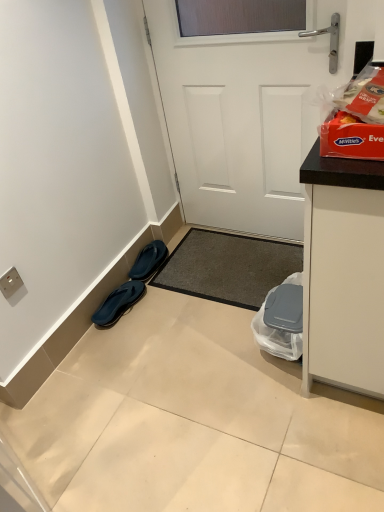
Where is `vacant area that is in front of white matte door at center`? vacant area that is in front of white matte door at center is located at coordinates (238, 286).